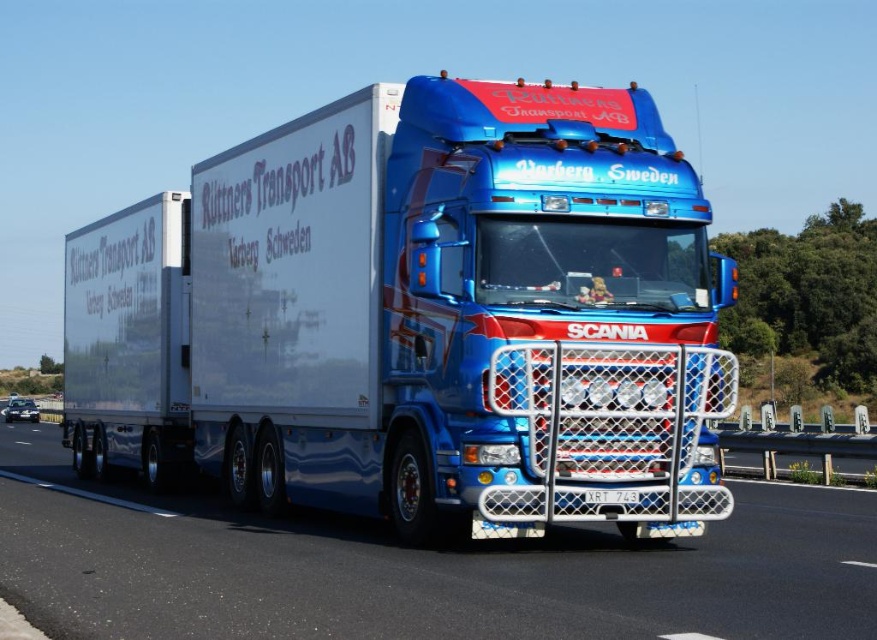
Who is positioned more to the left, metallic asphalt road at center or white plastic license plate at center?

Positioned to the left is metallic asphalt road at center.

Which is below, metallic asphalt road at center or white plastic license plate at center?

metallic asphalt road at center is below.

Identify the location of metallic asphalt road at center. (415, 570).

From the picture: Who is more forward, [536,323] or [139,548]?

Positioned in front is point [536,323].

Is point (538, 419) positioned after point (176, 588)?

That is True.

Which is in front, point (312, 163) or point (853, 564)?

Positioned in front is point (853, 564).

Locate an element on the screen. Image resolution: width=877 pixels, height=640 pixels. shiny metallic trailer truck at center is located at coordinates (417, 316).

Is shiny metallic trailer truck at center wider than white plastic license plate at center?

Correct, the width of shiny metallic trailer truck at center exceeds that of white plastic license plate at center.

The image size is (877, 640). I want to click on shiny metallic trailer truck at center, so click(x=417, y=316).

This screenshot has width=877, height=640. Find the location of `shiny metallic trailer truck at center`. shiny metallic trailer truck at center is located at coordinates (417, 316).